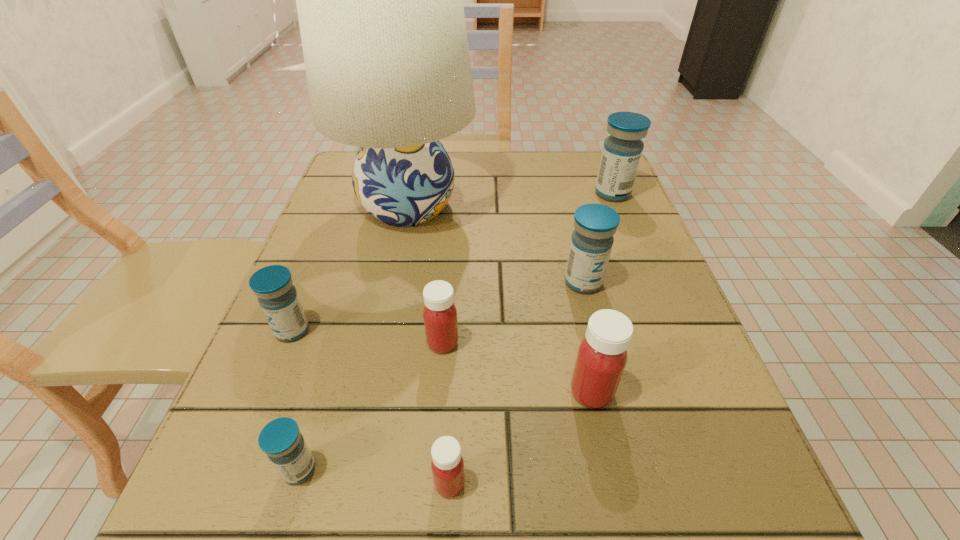
Find the location of a particular element. The image size is (960, 540). free region located 0.100m on the right of the smallest blue medicine is located at coordinates (395, 469).

Locate an element on the screen. This screenshot has height=540, width=960. free space located on the back of the nearest red medicine is located at coordinates (458, 318).

This screenshot has height=540, width=960. I want to click on lampshade that is at the far edge, so click(380, 6).

This screenshot has width=960, height=540. Identify the location of medicine situated at the far edge. (622, 150).

Locate an element on the screen. lampshade at the left edge is located at coordinates (380, 6).

Locate an element on the screen. The height and width of the screenshot is (540, 960). object that is at the far left corner is located at coordinates (380, 6).

Where is `object at the near left corner`? This screenshot has height=540, width=960. object at the near left corner is located at coordinates (280, 439).

Identify the location of object that is at the far right corner. The width and height of the screenshot is (960, 540). (622, 150).

I want to click on vacant area at the far edge, so click(480, 197).

In the image, there is a desktop. Find the location of `vacant space at the near edge`. vacant space at the near edge is located at coordinates (484, 483).